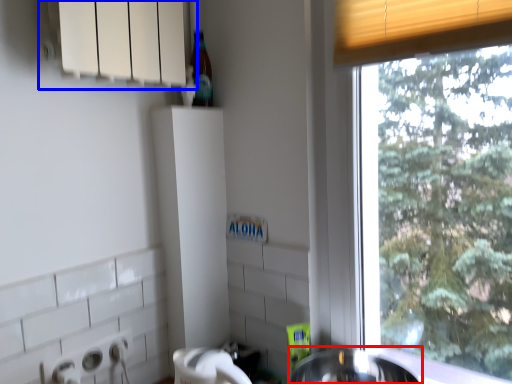
Question: Which object is closer to the camera taking this photo, sink (highlighted by a red box) or window sill (highlighted by a blue box)?

Choices:
 (A) sink
 (B) window sill

Answer: (B)